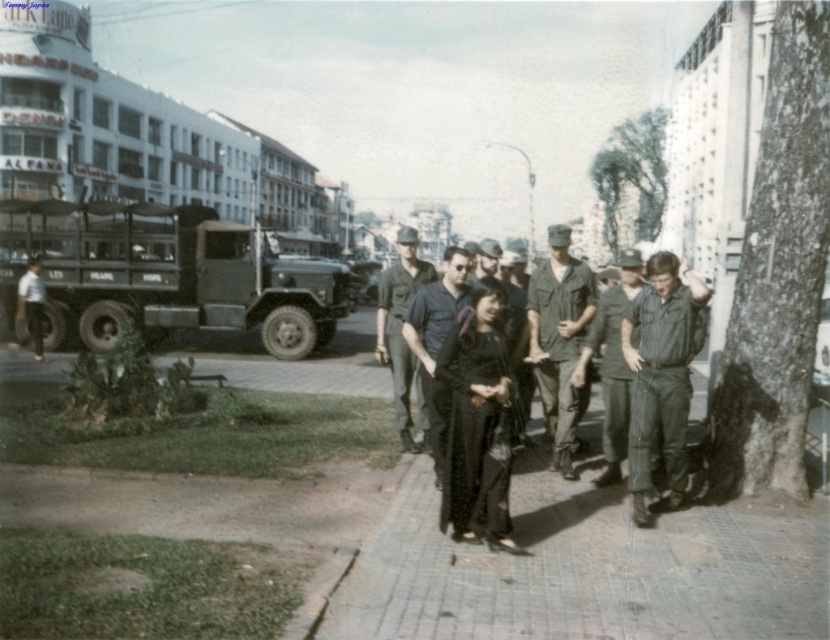
You are a drone operator trying to locate a specific point in the image. The point is marked at coordinates (399, 332). What object is located at this point?

The point at coordinates (399, 332) indicates the dark green uniform at center.

Based on the photo, you are standing at the point with coordinates point [404,317] and want to move towards point [30,321]. Given that you can only move in a straight line, will you be moving towards the background or towards the foreground of the image?

Since point [404,317] is closer to the viewer than point [30,321], moving from the former to the latter would mean moving towards the background of the image.

You are a photographer trying to capture a clear shot of the black matte shirt at center and the matte green uniform at left. Based on their sizes, which one would appear closer to the camera?

The black matte shirt at center appears larger than the matte green uniform at left, so it would seem closer to the camera.